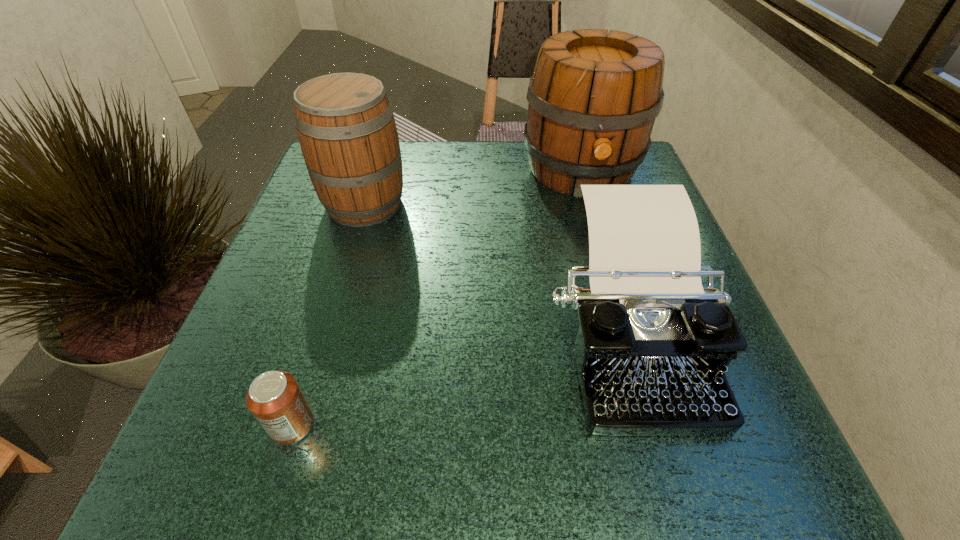
Locate an element on the screen. This screenshot has height=540, width=960. vacant area at the left edge of the desktop is located at coordinates (360, 231).

The width and height of the screenshot is (960, 540). I want to click on vacant position at the right edge of the desktop, so click(729, 368).

At what (x,y) coordinates should I click in order to perform the action: click on vacant space at the far right corner. Please return your answer as a coordinate pair (x, y). Image resolution: width=960 pixels, height=540 pixels. Looking at the image, I should click on (643, 167).

You are a GUI agent. You are given a task and a screenshot of the screen. Output one action in this format:
    pyautogui.click(x=<x>, y=<y>)
    Task: Click on the free region at the near right corner of the desktop
    The width and height of the screenshot is (960, 540).
    Given the screenshot: What is the action you would take?
    pyautogui.click(x=670, y=485)

Where is `free point between the second shortest object and the shortest object`? The width and height of the screenshot is (960, 540). free point between the second shortest object and the shortest object is located at coordinates (460, 380).

You are a GUI agent. You are given a task and a screenshot of the screen. Output one action in this format:
    pyautogui.click(x=<x>, y=<y>)
    Task: Click on the blank region between the right cider and the can
    The width and height of the screenshot is (960, 540).
    Given the screenshot: What is the action you would take?
    pyautogui.click(x=437, y=298)

Locate an element on the screen. The width and height of the screenshot is (960, 540). empty location between the left cider and the right cider is located at coordinates (472, 187).

Identify the location of vacant point located between the left cider and the right cider. This screenshot has width=960, height=540. (472, 187).

In order to click on free space between the left cider and the right cider in this screenshot , I will do `click(472, 187)`.

Locate an element on the screen. vacant area between the typewriter and the left cider is located at coordinates (496, 269).